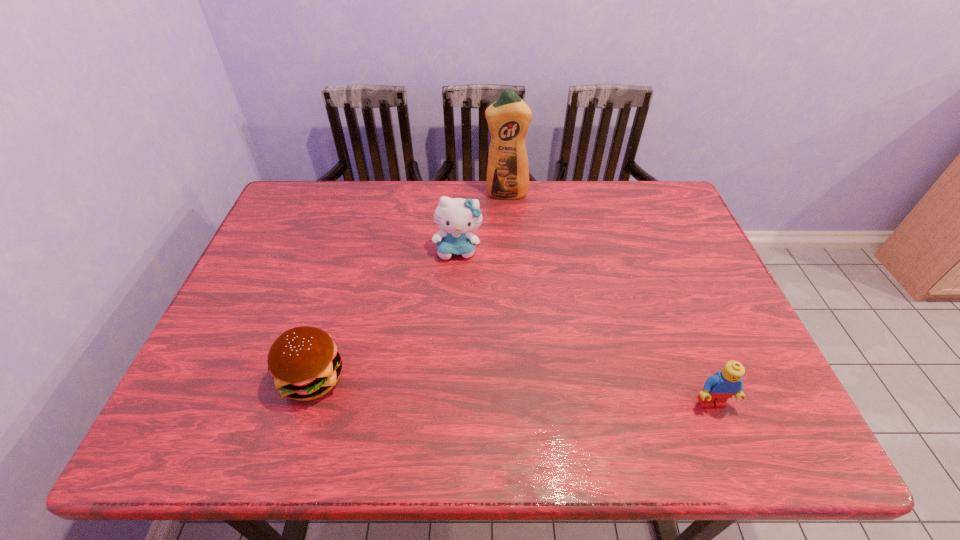
This screenshot has width=960, height=540. What are the coordinates of `vacant space on the desktop that is between the hamburger and the rightmost object and is positioned on the face of the second tallest object` in the screenshot? It's located at pos(457,387).

Locate an element on the screen. vacant spot on the desktop that is between the leftmost object and the Lego and is positioned on the label of the farthest object is located at coordinates (518, 391).